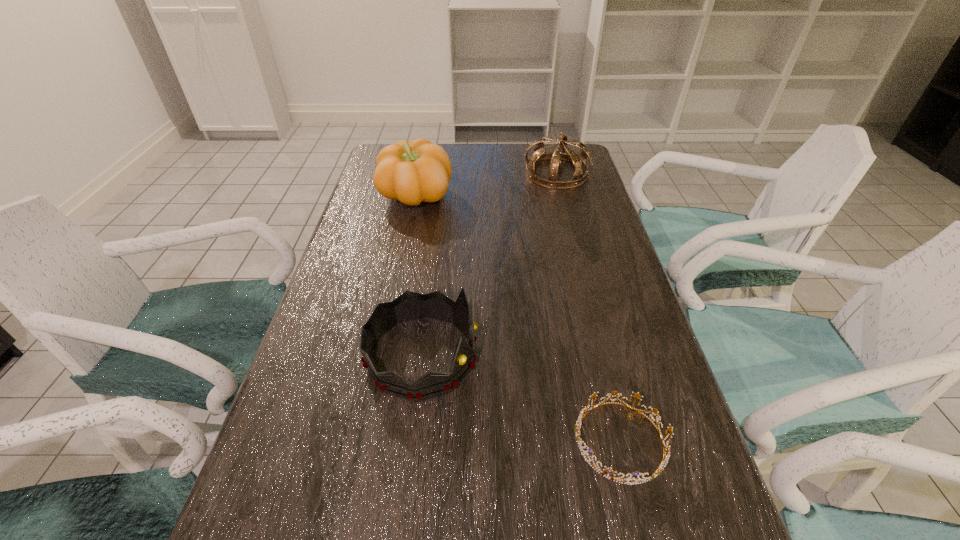
The width and height of the screenshot is (960, 540). What are the coordinates of `object at the far edge` in the screenshot? It's located at (579, 161).

The image size is (960, 540). Find the location of `pumpkin positioned at the left edge`. pumpkin positioned at the left edge is located at coordinates (412, 172).

Identify the location of tiara that is positioned at the left edge. (409, 306).

The height and width of the screenshot is (540, 960). In order to click on object at the far right corner in this screenshot , I will do `click(579, 161)`.

I want to click on vacant space at the left edge of the desktop, so [x=350, y=262].

In the image, there is a desktop. At what (x,y) coordinates should I click in order to perform the action: click on free space at the right edge. Please return your answer as a coordinate pair (x, y). This screenshot has height=540, width=960. Looking at the image, I should click on (626, 296).

You are a GUI agent. You are given a task and a screenshot of the screen. Output one action in this format:
    pyautogui.click(x=<x>, y=<y>)
    Task: Click on the vacant space at the far right corner of the desktop
    This screenshot has width=960, height=540.
    Given the screenshot: What is the action you would take?
    pos(588,165)

In order to click on blank region between the shortest object and the farthest tiara in this screenshot , I will do `click(588, 307)`.

The image size is (960, 540). Find the location of `vacant area between the pumpkin and the farthest tiara`. vacant area between the pumpkin and the farthest tiara is located at coordinates (486, 185).

The height and width of the screenshot is (540, 960). I want to click on blank region between the leftmost tiara and the pumpkin, so click(x=419, y=276).